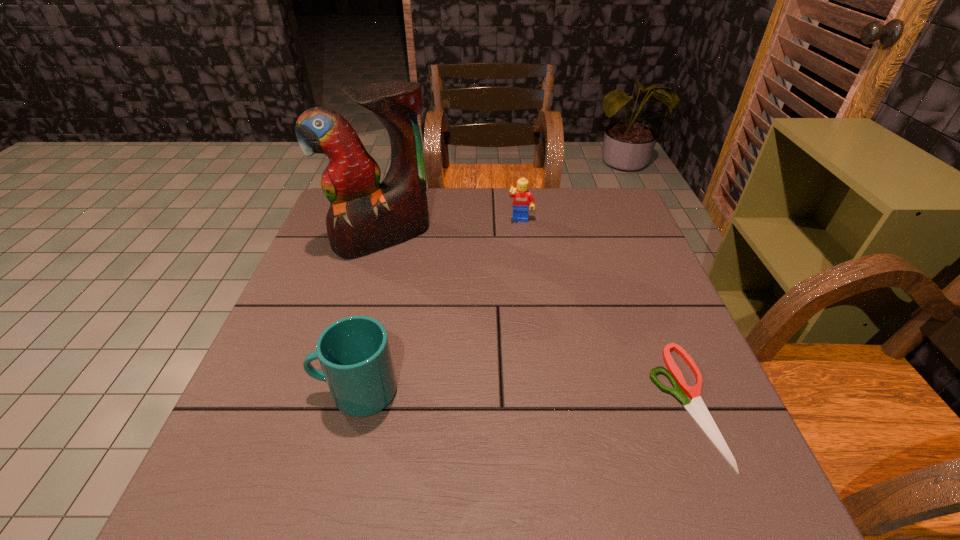
Where is `vacant space located at the face of the tallest object`? The height and width of the screenshot is (540, 960). vacant space located at the face of the tallest object is located at coordinates (476, 360).

This screenshot has height=540, width=960. Find the location of `blank area located 0.320m at the face of the tallest object`. blank area located 0.320m at the face of the tallest object is located at coordinates (460, 338).

This screenshot has width=960, height=540. I want to click on vacant space situated at the face of the tallest object, so click(x=413, y=273).

You are a GUI agent. You are given a task and a screenshot of the screen. Output one action in this format:
    pyautogui.click(x=<x>, y=<y>)
    Task: Click on the Lego positioned at the far edge
    The height and width of the screenshot is (540, 960).
    Given the screenshot: What is the action you would take?
    pyautogui.click(x=523, y=200)

The image size is (960, 540). What are the coordinates of `parrot located at the far edge` in the screenshot? It's located at (365, 216).

Locate an element on the screen. cup present at the near edge is located at coordinates (354, 353).

Where is `scissors present at the near edge`? scissors present at the near edge is located at coordinates (696, 408).

The height and width of the screenshot is (540, 960). What are the coordinates of `cup situated at the left edge` in the screenshot? It's located at (354, 353).

Where is `parrot that is at the left edge`? The width and height of the screenshot is (960, 540). parrot that is at the left edge is located at coordinates (365, 216).

Find the location of a particular element. The height and width of the screenshot is (540, 960). object present at the right edge is located at coordinates (696, 408).